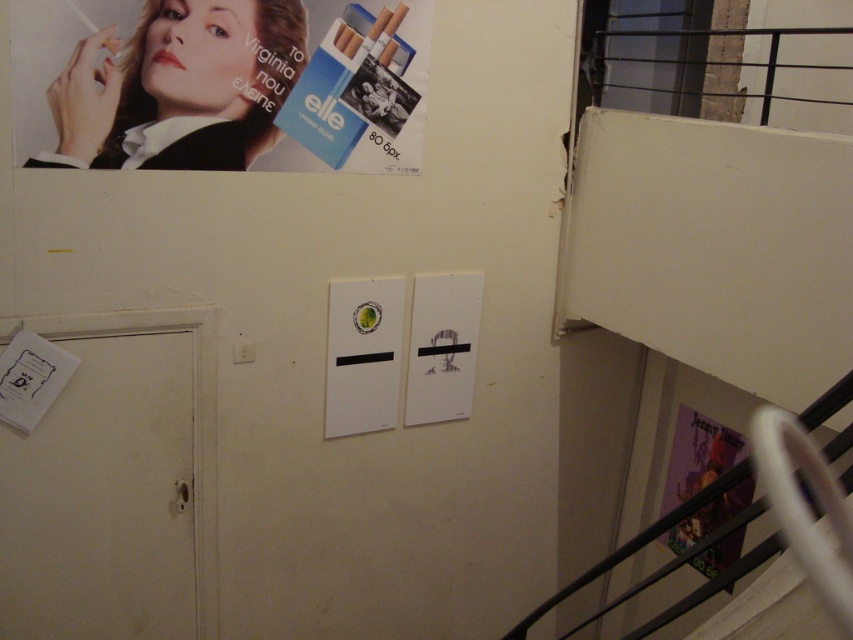
You are a maintenance worker checking the wall for damage. You notice two points marked on the wall. The first point is at coordinates point (468, 340) and the second is at point (727, 442). Which point is closer to you when standing in front of the wall?

Point (468, 340) is in front of point (727, 442), so the first point is closer to you.

From the picture: You are standing in front of the wall with the cigarette poster. There are two points marked on the wall. Which point is closer to you, point (328,419) or point (469,326)?

Point (328,419) is closer to the viewer than point (469,326).

You are an office worker who needs to hang a new memo on the wall. You see the white matte sign at center and the white paper at center. Which object is shorter so you can place your memo above it?

The white matte sign at center is not as tall as the white paper at center, so you can place your memo above the white matte sign at center.